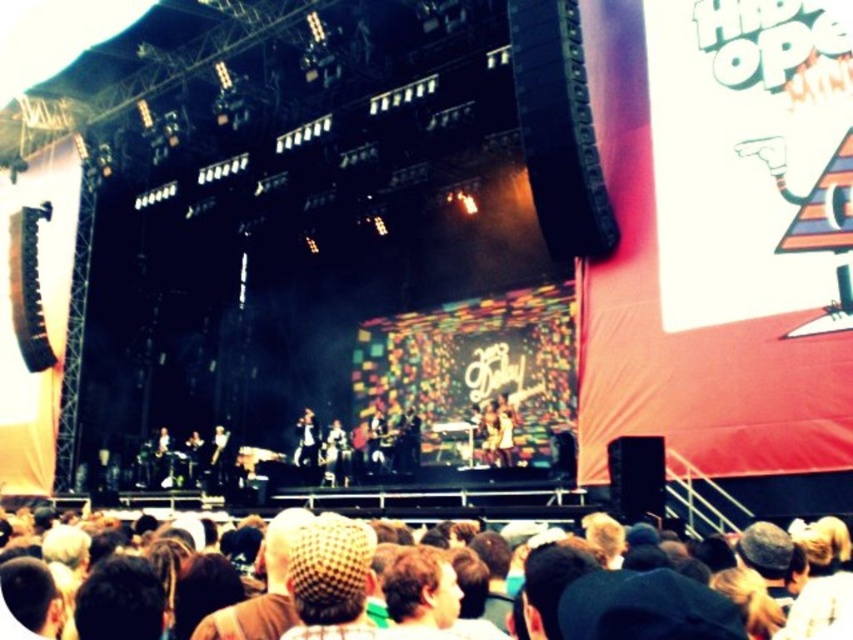
From the picture: You are a photographer at the concert and want to capture a photo of both the black leather jacket at center and the shiny black microphone at center. Which object should you focus on first to ensure both are in the frame?

You should focus on the black leather jacket at center first since it is closer to you than the shiny black microphone at center, ensuring both are in the frame.

You are a photographer at the concert and want to capture both the black leather jacket at center and the shiny black microphone at center in a single frame. Since you want to emphasize the larger object, which one should you focus on to ensure it takes up more space in your photo?

The black leather jacket at center is wider than the shiny black microphone at center, so focusing on it will ensure it takes up more space in the photo.

You are a photographer at the concert and want to capture a photo that includes both the brown hair at center and the shiny black microphone at center. Given that your camera has a maximum zoom range of 30 meters, will you be able to fit both objects into the frame without moving closer?

The brown hair at center and the shiny black microphone at center are 38.95 meters apart, which exceeds the camera maximum zoom range of 30 meters. Therefore, you cannot fit both objects into the frame without moving closer.